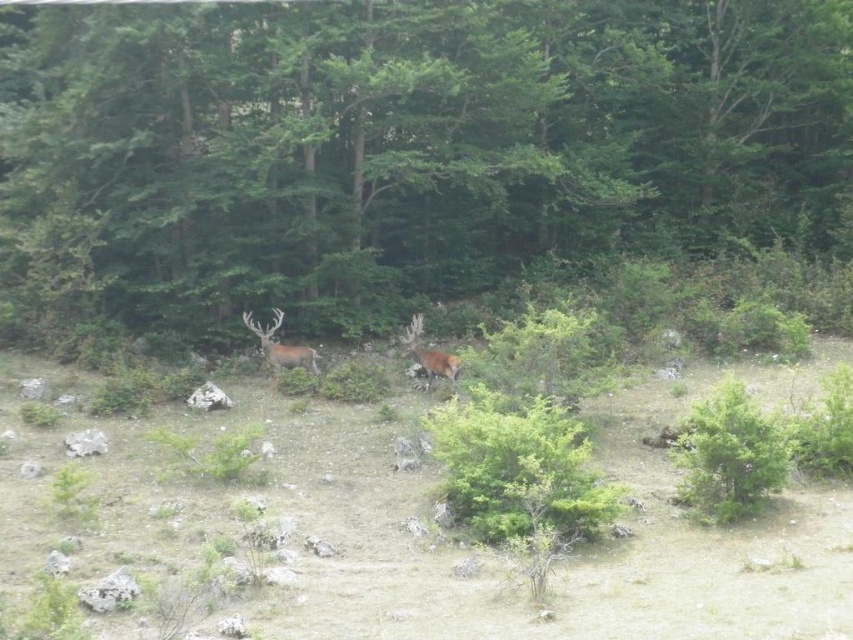
Is brown velvet deer at center to the right of brown furry deer at center from the viewer's perspective?

In fact, brown velvet deer at center is to the left of brown furry deer at center.

Who is positioned more to the right, brown velvet deer at center or brown furry deer at center?

brown furry deer at center is more to the right.

Where is `brown velvet deer at center`? Image resolution: width=853 pixels, height=640 pixels. brown velvet deer at center is located at coordinates (280, 346).

Is point (390, 264) more distant than point (416, 337)?

Yes, point (390, 264) is farther from viewer.

Who is positioned more to the right, green leafy tree at center or brown furry deer at center?

green leafy tree at center is more to the right.

Measure the distance between point [482,177] and camera.

A distance of 101.91 feet exists between point [482,177] and camera.

What are the coordinates of `green leafy tree at center` in the screenshot? It's located at 407,145.

Is green leafy tree at center further to camera compared to brown velvet deer at center?

No, green leafy tree at center is closer to the viewer.

Between point (627, 198) and point (277, 324), which one is positioned in front?

Positioned in front is point (277, 324).

Between point (155, 256) and point (274, 356), which one is positioned in front?

Point (274, 356) is more forward.

This screenshot has width=853, height=640. Find the location of `green leafy tree at center`. green leafy tree at center is located at coordinates (407, 145).